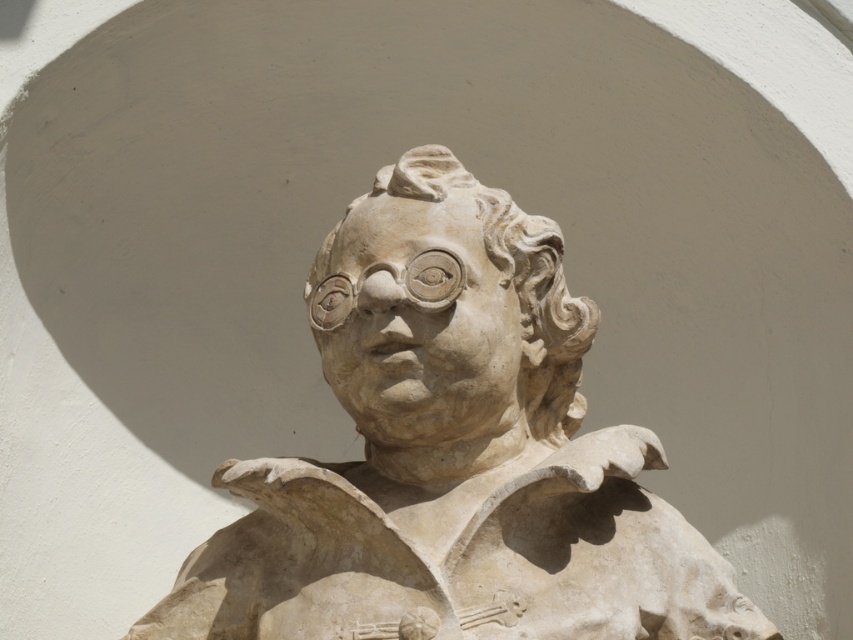
Can you confirm if stone sculpture at center is positioned to the right of white stone head at center?

Correct, you'll find stone sculpture at center to the right of white stone head at center.

Which is behind, point (351, 515) or point (381, 180)?

Positioned behind is point (381, 180).

You are a GUI agent. You are given a task and a screenshot of the screen. Output one action in this format:
    pyautogui.click(x=<x>, y=<y>)
    Task: Click on the stone sculpture at center
    
    Given the screenshot: What is the action you would take?
    pyautogui.click(x=453, y=456)